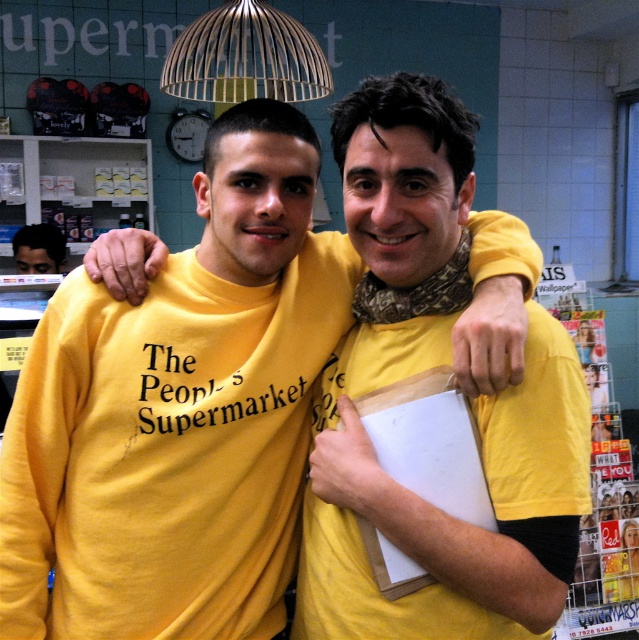
Question: Does yellow matte shirt at center lie in front of matte black face at left?

Choices:
 (A) yes
 (B) no

Answer: (A)

Question: Can you confirm if yellow matte shirt at center is smaller than matte black face at left?

Choices:
 (A) yes
 (B) no

Answer: (B)

Question: Which point is closer to the camera?

Choices:
 (A) yellow matte shirt at center
 (B) matte black face at left

Answer: (A)

Question: Which of the following is the closest to the observer?

Choices:
 (A) matte black face at left
 (B) yellow matte shirt at center

Answer: (B)

Question: Is yellow matte shirt at center below matte black face at left?

Choices:
 (A) yes
 (B) no

Answer: (A)